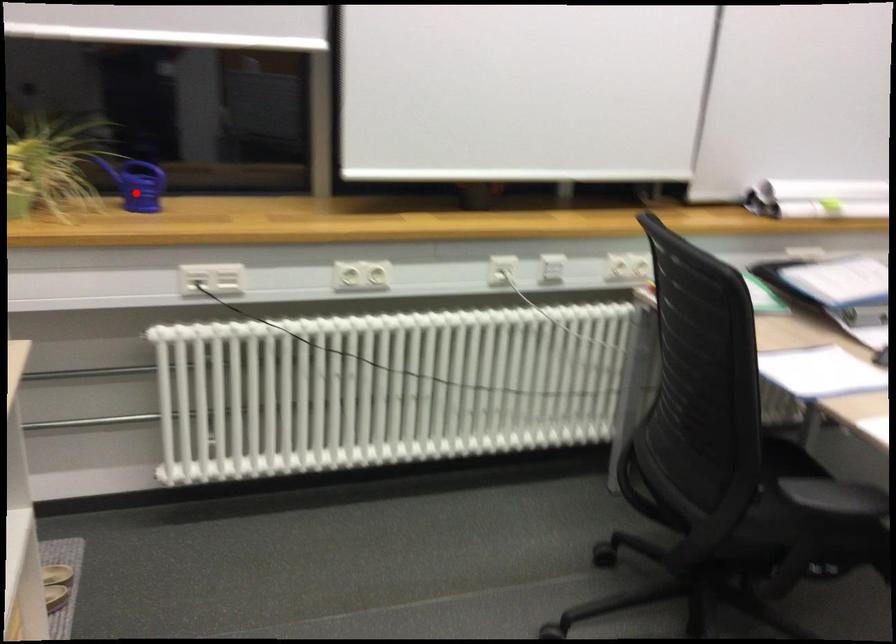
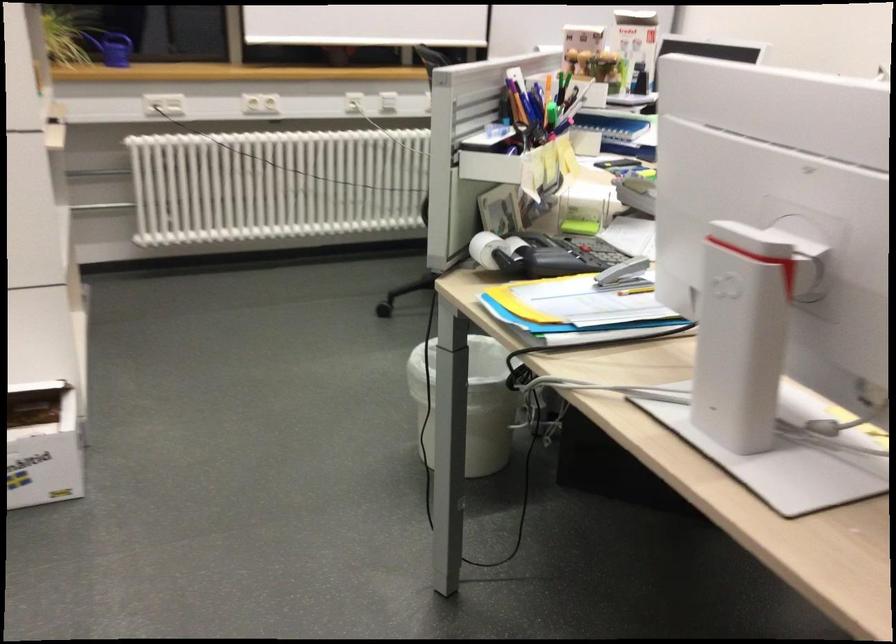
Question: I am providing you with two images of the same scene from different viewpoints. Image1 has a red point marked. In image2, the corresponding 3D location appears at what relative position? Reply with the corresponding letter.

Choices:
 (A) Closer
 (B) Farther

Answer: (B)